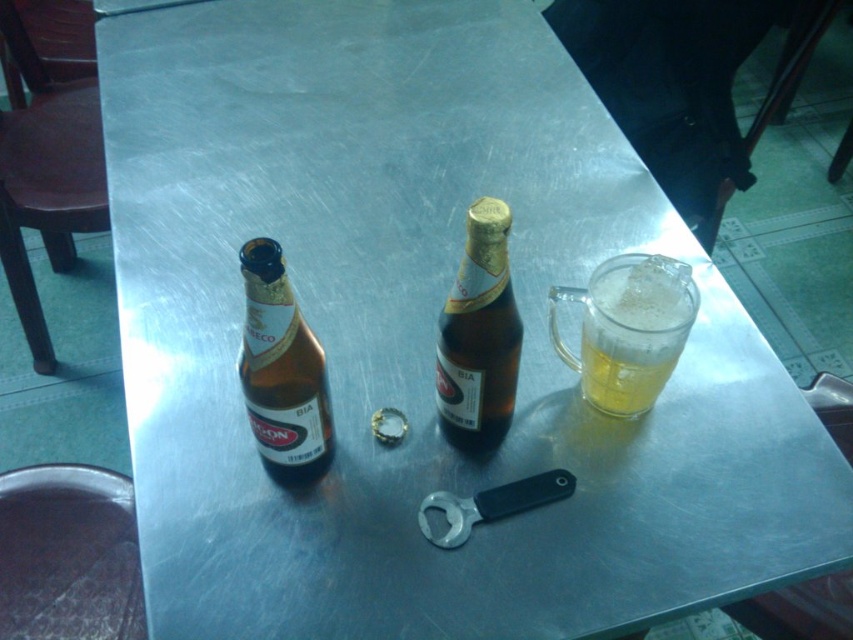
Question: Which object is the closest to the translucent glass mug at right?

Choices:
 (A) brown glass bottle at center
 (B) brown glass bottle at left

Answer: (A)

Question: Which point is closer to the camera?

Choices:
 (A) brown glass bottle at center
 (B) translucent glass mug at right
 (C) brown glass bottle at left

Answer: (C)

Question: Among these objects, which one is farthest from the camera?

Choices:
 (A) translucent glass mug at right
 (B) brown glass bottle at center
 (C) brown glass bottle at left

Answer: (A)

Question: Does translucent glass mug at right appear under brown glass bottle at center?

Choices:
 (A) no
 (B) yes

Answer: (B)

Question: Does translucent glass mug at right have a larger size compared to brown glass bottle at left?

Choices:
 (A) no
 (B) yes

Answer: (A)

Question: Does brown glass bottle at center have a smaller size compared to brown glass bottle at left?

Choices:
 (A) no
 (B) yes

Answer: (A)